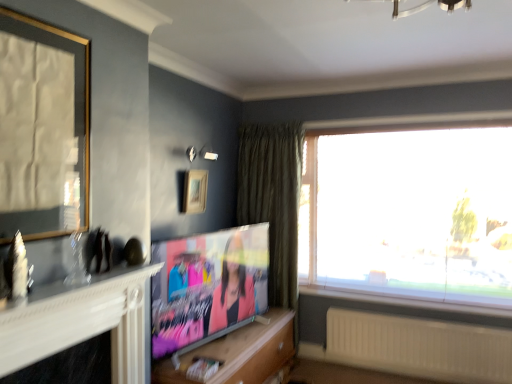
Locate an element on the screen. The width and height of the screenshot is (512, 384). free space above white glossy fireplace at left (from a real-world perspective) is located at coordinates (64, 289).